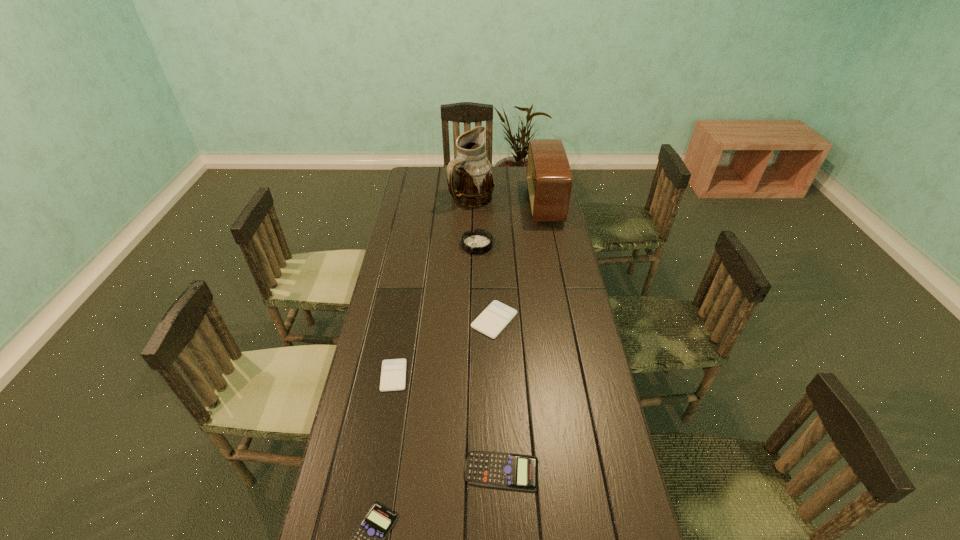
Identify the location of the farther blue calculator. Image resolution: width=960 pixels, height=540 pixels. (483, 468).

Find the location of a particular element. the sixth farthest object is located at coordinates (483, 468).

The width and height of the screenshot is (960, 540). What are the coordinates of `vacant space situated 0.280m from the spout of the pitcher` in the screenshot? It's located at (470, 251).

The height and width of the screenshot is (540, 960). I want to click on free space located 0.140m on the front-facing side of the radio receiver, so click(x=499, y=204).

Locate an element on the screen. The height and width of the screenshot is (540, 960). free spot located on the front-facing side of the radio receiver is located at coordinates (512, 204).

This screenshot has height=540, width=960. I want to click on vacant space located 0.150m on the front-facing side of the radio receiver, so click(x=497, y=204).

The width and height of the screenshot is (960, 540). I want to click on free location located 0.280m on the right of the third farthest object, so click(558, 245).

Locate an element on the screen. The width and height of the screenshot is (960, 540). vacant space located on the back of the fourth nearest object is located at coordinates (493, 280).

Locate an element on the screen. free space located on the right of the second farthest calculator is located at coordinates (515, 375).

Identify the location of free space located 0.220m on the left of the right blue calculator. (381, 471).